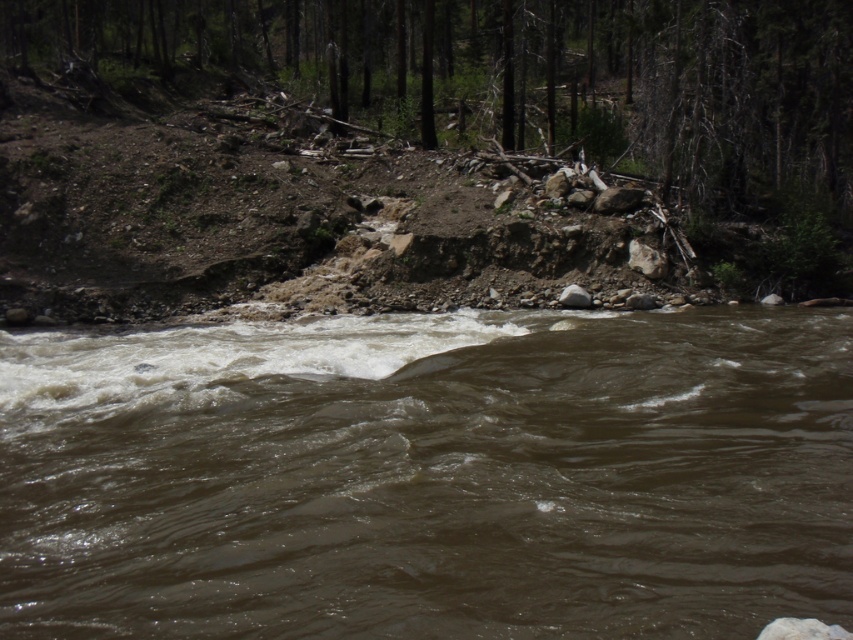
Question: Which point is farther to the camera?

Choices:
 (A) (601, 166)
 (B) (318, 499)

Answer: (A)

Question: Which object appears farthest from the camera in this image?

Choices:
 (A) brown rough tree trunk at upper center
 (B) brown muddy water at center

Answer: (A)

Question: Which of the following is the closest to the observer?

Choices:
 (A) brown muddy water at center
 (B) brown rough tree trunk at upper center

Answer: (A)

Question: Does brown muddy water at center lie behind brown rough tree trunk at upper center?

Choices:
 (A) yes
 (B) no

Answer: (B)

Question: Can you confirm if brown muddy water at center is positioned above brown rough tree trunk at upper center?

Choices:
 (A) yes
 (B) no

Answer: (B)

Question: Does brown muddy water at center appear on the left side of brown rough tree trunk at upper center?

Choices:
 (A) yes
 (B) no

Answer: (B)